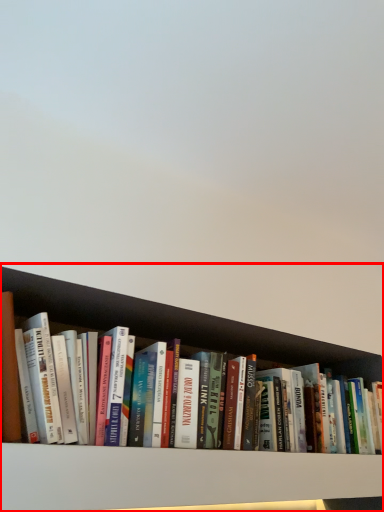
Question: From the image's perspective, where is shelf (annotated by the red box) located in relation to shelf in the image?

Choices:
 (A) below
 (B) above

Answer: (B)